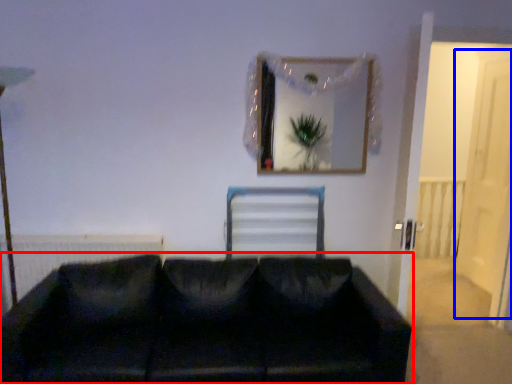
Question: Among these objects, which one is nearest to the camera, studio couch (highlighted by a red box) or glass door (highlighted by a blue box)?

Choices:
 (A) studio couch
 (B) glass door

Answer: (A)